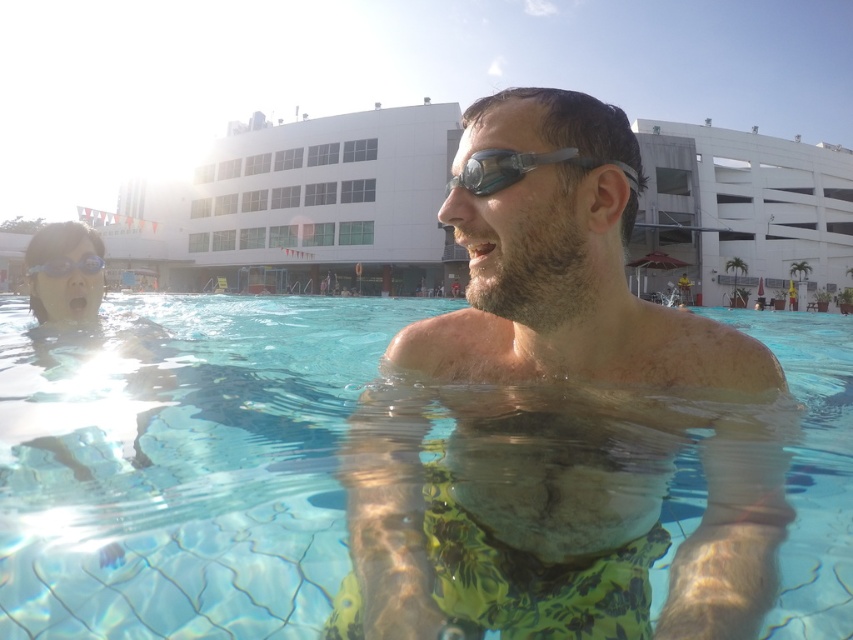
You are a lifeguard observing the scene from the pool deck. You need to locate the transparent silicone goggles at center. According to the coordinates provided, where exactly should you look in the image?

The transparent silicone goggles at center are located at the 2D coordinates point (508, 168) in the image.

You are a lifeguard observing the pool area. There is a point marked at coordinates (x=508, y=168) in the image. What object is located at this point?

The point at coordinates (x=508, y=168) marks the location of transparent silicone goggles at center.

From the picture: You are a photographer trying to capture a clear shot of the green floral shorts at center and the transparent plastic water at center. Which object will appear larger in your photo?

The green floral shorts at center will appear larger in the photo because the transparent plastic water at center is not as tall as the green floral shorts at center.